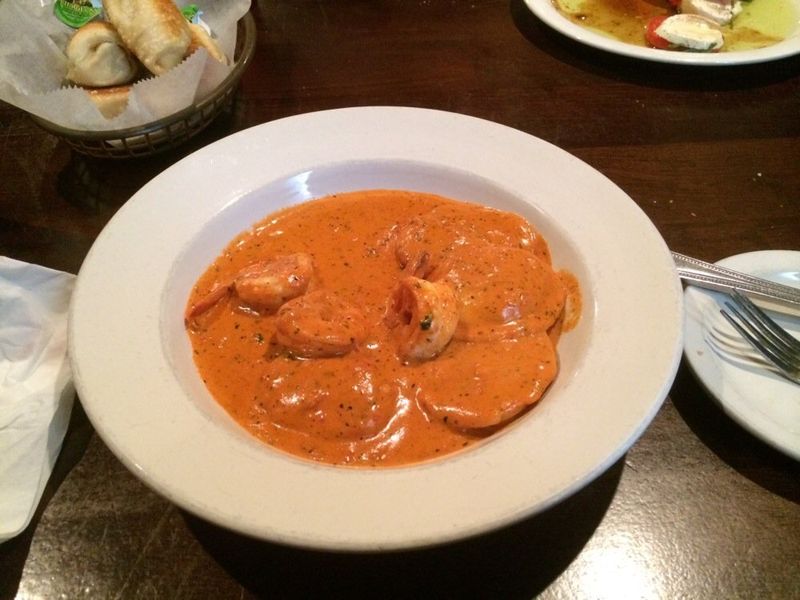
The image size is (800, 600). I want to click on bottom white bowl, so click(356, 524).